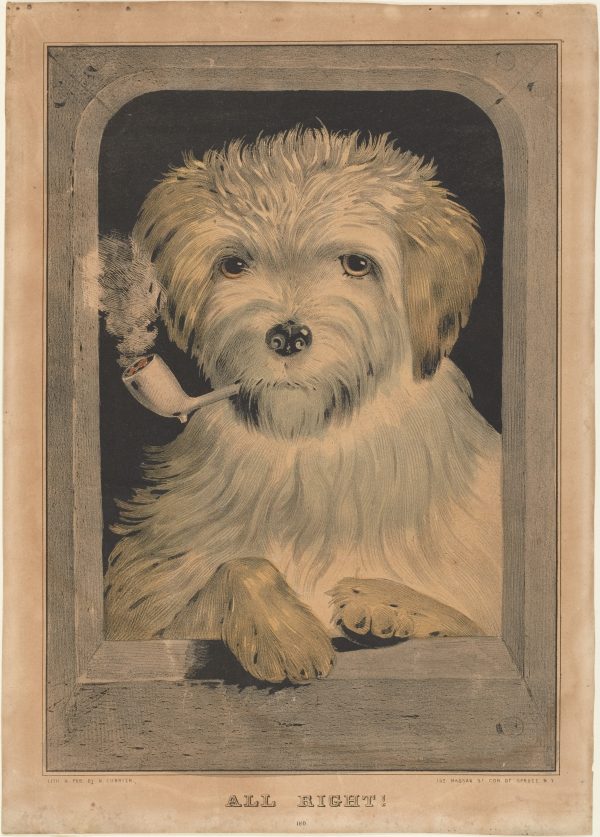
This screenshot has height=837, width=600. I want to click on painting, so click(x=264, y=330).